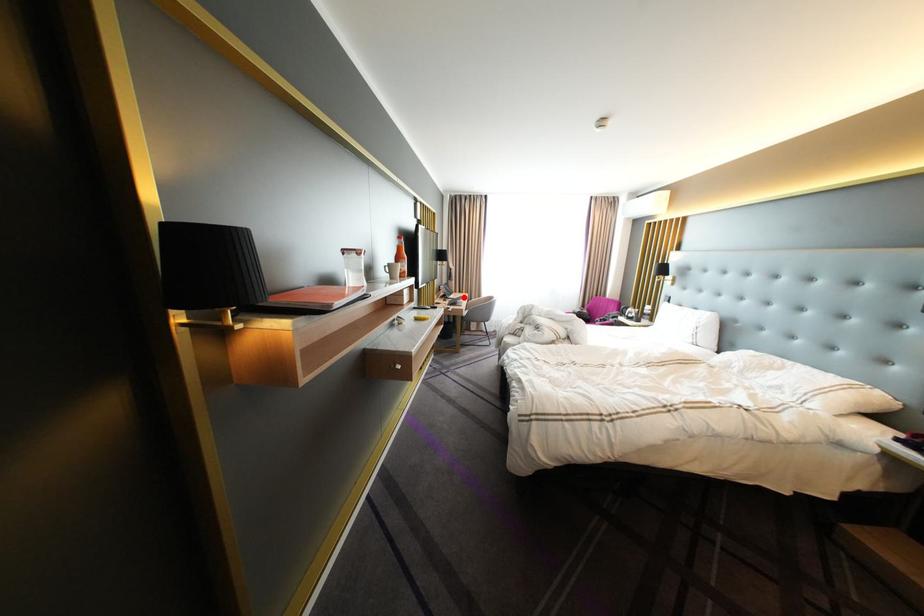
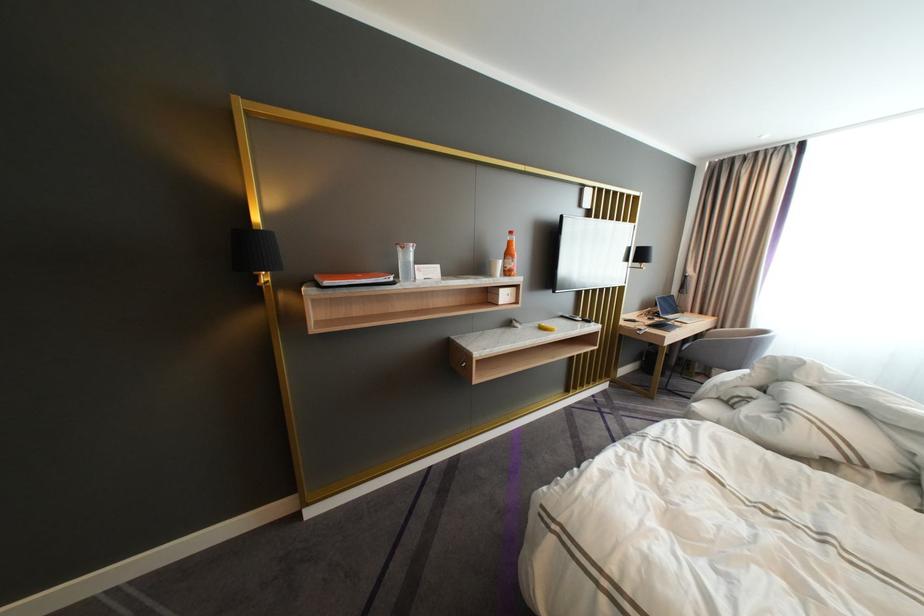
Find the pixel in the second image that matches the highlighted location in the first image.

(683, 317)